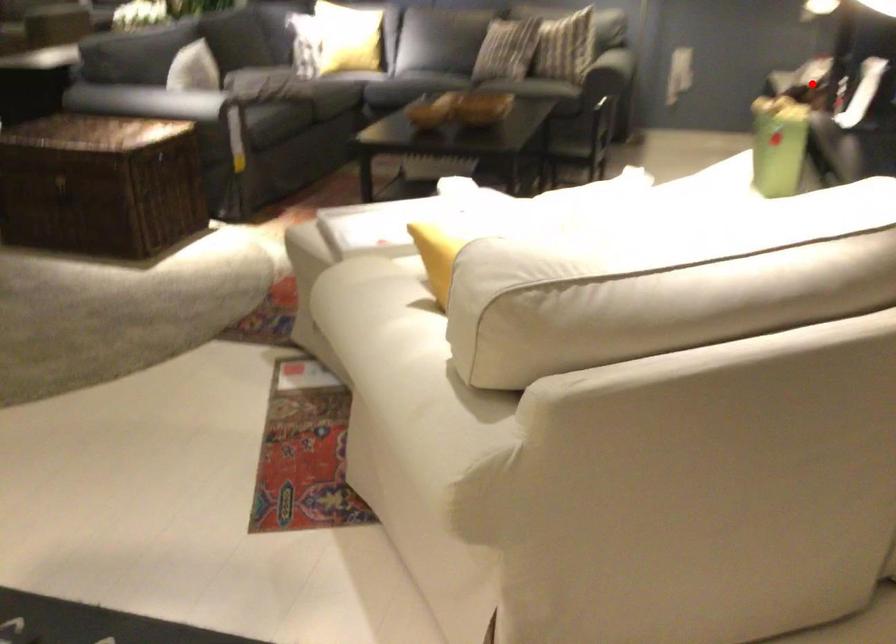
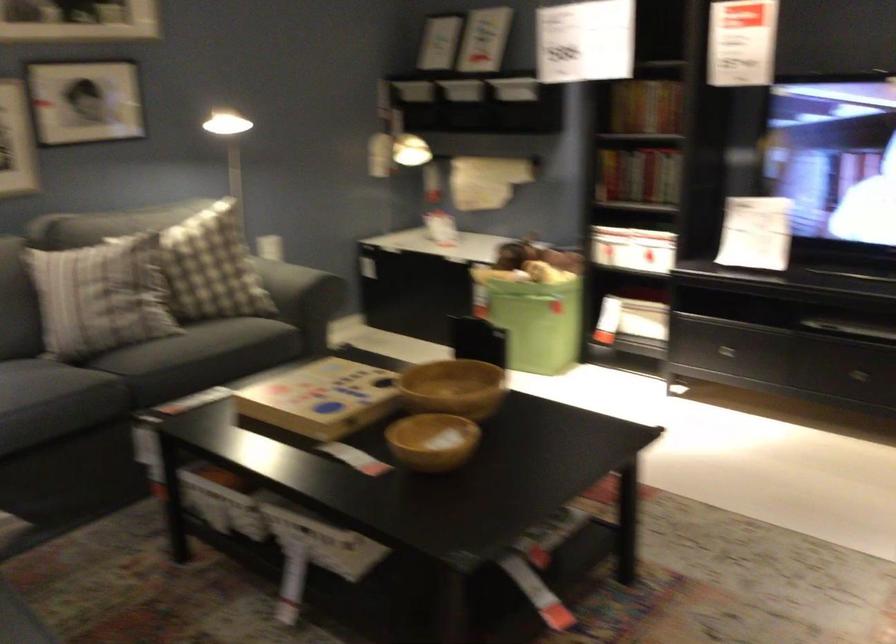
Where in the second image is the point corresponding to the highlighted location from the first image?

(633, 249)